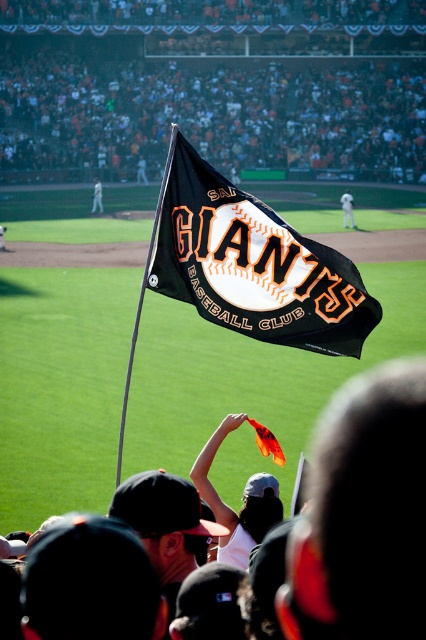
Question: Which object appears farthest from the camera in this image?

Choices:
 (A) white fabric flag at upper center
 (B) black fabric crowd at upper center
 (C) black fabric flag at center
 (D) white uniform at center

Answer: (B)

Question: Does black fabric crowd at upper center appear under black fabric flag at center?

Choices:
 (A) yes
 (B) no

Answer: (B)

Question: Which object appears closest to the camera in this image?

Choices:
 (A) white uniform at center
 (B) black fabric flag at center
 (C) black fabric crowd at upper center
 (D) white fabric flag at upper center

Answer: (B)

Question: Can you confirm if white uniform at center is positioned below white fabric flag at upper center?

Choices:
 (A) yes
 (B) no

Answer: (A)

Question: Can you confirm if black fabric flag at center is bigger than white uniform at center?

Choices:
 (A) yes
 (B) no

Answer: (B)

Question: Which point is closer to the camera?

Choices:
 (A) (172, 193)
 (B) (348, 216)

Answer: (A)